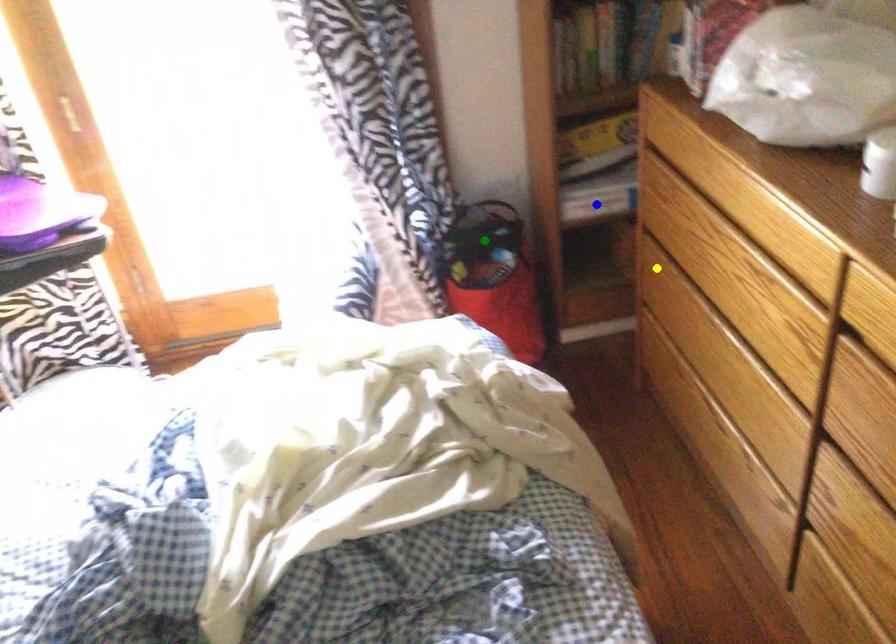
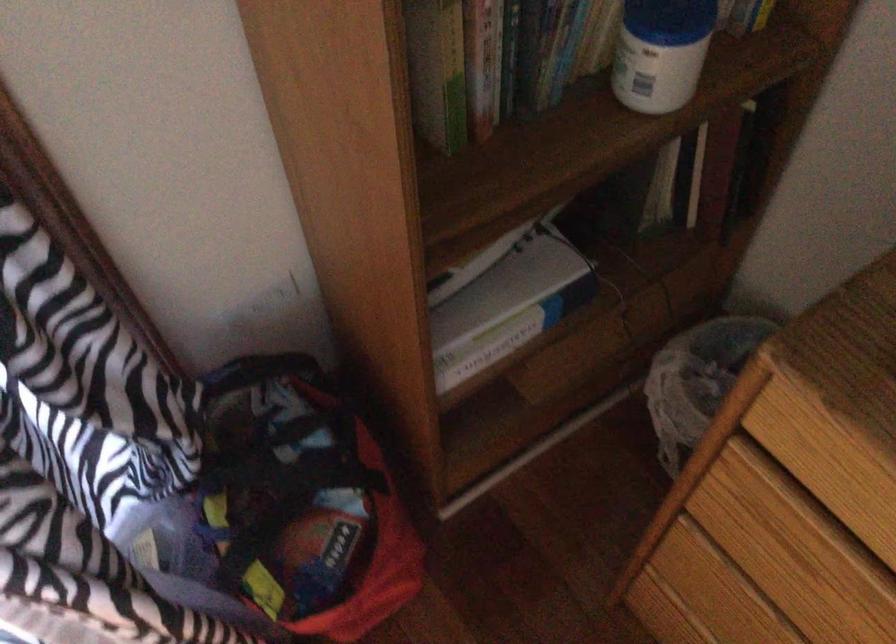
I am providing you with two images of the same scene from different viewpoints. Three points are marked in image1. Which point corresponds to a part or object that is occluded in image2?In image1, three points are marked. Which of them correspond to a part or object that is occluded in image2?Among the three points shown in image1, which one corresponds to a part or object that is no longer visible due to occlusion in image2?

blue point